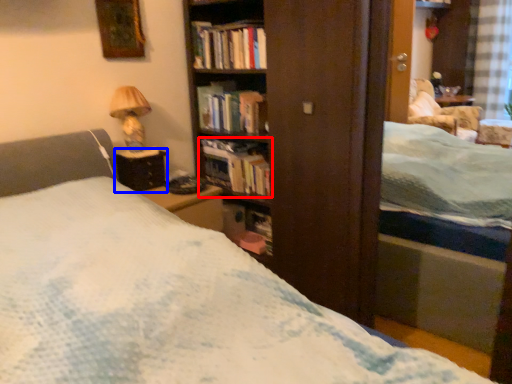
Question: Which object is further to the camera taking this photo, book (highlighted by a red box) or table (highlighted by a blue box)?

Choices:
 (A) book
 (B) table

Answer: (A)